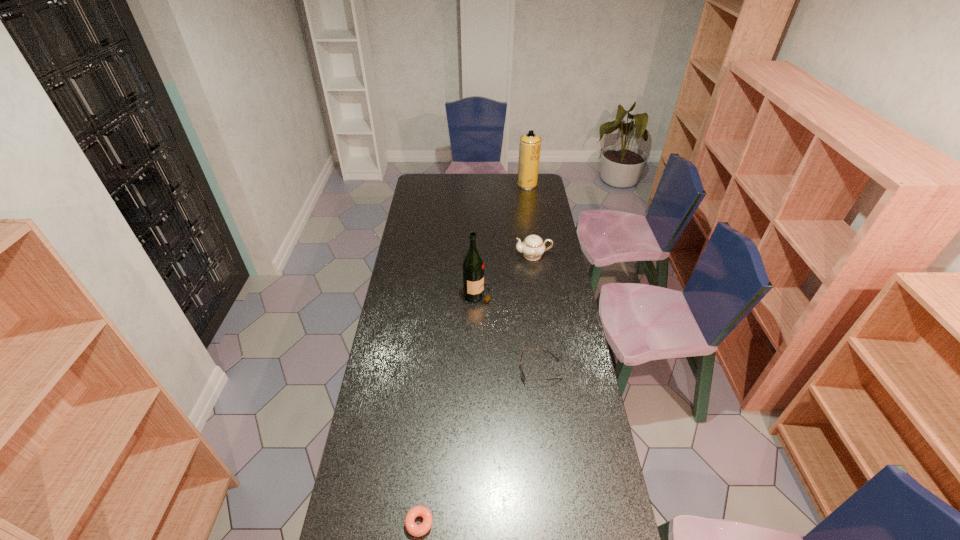
Locate an element on the screen. Image resolution: width=960 pixels, height=540 pixels. chinaware that is at the right edge is located at coordinates (532, 247).

Locate an element on the screen. This screenshot has width=960, height=540. sunglasses present at the right edge is located at coordinates (521, 370).

This screenshot has width=960, height=540. I want to click on object that is at the far right corner, so click(x=529, y=150).

Find the location of a particular element. This screenshot has width=960, height=540. free space at the far edge of the desktop is located at coordinates (453, 174).

Identify the location of vacant space at the left edge. This screenshot has width=960, height=540. (419, 274).

Image resolution: width=960 pixels, height=540 pixels. What are the coordinates of `vacant area at the right edge` in the screenshot? It's located at (533, 205).

Identify the location of free space between the aerosol can and the third farthest object. This screenshot has width=960, height=540. (503, 239).

Locate an element on the screen. free spot between the second nearest object and the third shortest object is located at coordinates (537, 313).

At what (x,y) coordinates should I click in order to perform the action: click on vacant area that lies between the nearest object and the third farthest object. Please return your answer as a coordinate pair (x, y). This screenshot has height=540, width=960. Looking at the image, I should click on (449, 409).

Locate an element on the screen. This screenshot has height=540, width=960. free space between the aerosol can and the third shortest object is located at coordinates (530, 220).